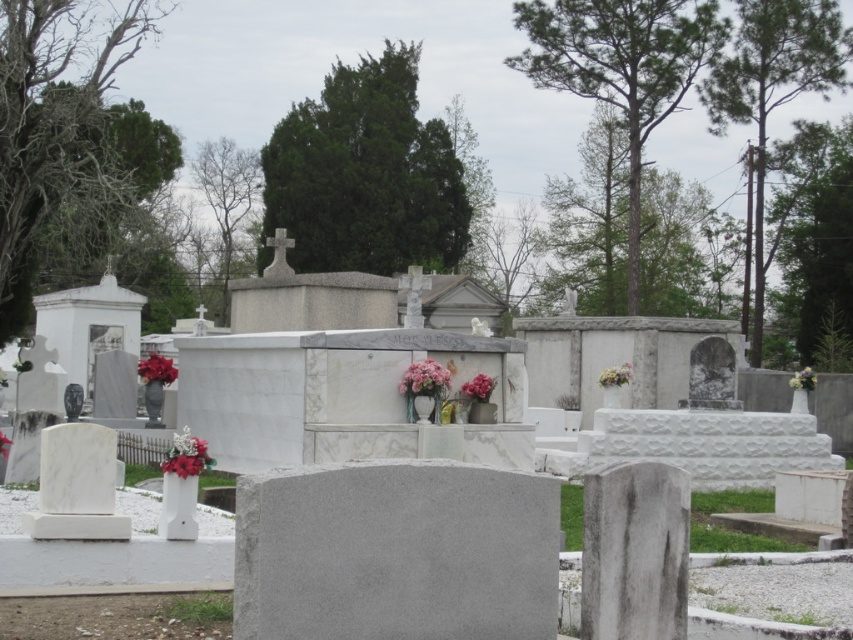
You are standing in the cemetery and see both the pink fabric flowers at center and the red matte flower at center. Which one is positioned more to the left?

The red matte flower at center is positioned more to the left because the pink fabric flowers at center are to the right of it.

You are standing in a cemetery and want to place a wreath on the closest tombstone between the white marble tombstones at center and the gray marble gravestone at center. Which one should you choose?

The white marble tombstones at center is closer to you, so you should choose the white marble tombstones at center to place the wreath.

You are standing at the point with coordinates point (x=398, y=632) and want to walk towards the point with coordinates point (x=204, y=436). Will you be moving forward or backward relative to your current position?

Since point (x=204, y=436) is behind point (x=398, y=632), moving towards it would mean you are moving backward relative to your current position at point (x=398, y=632).